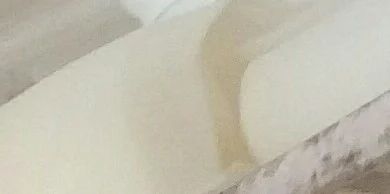
Find the location of a particular element. The width and height of the screenshot is (390, 194). foam is located at coordinates (124, 121).